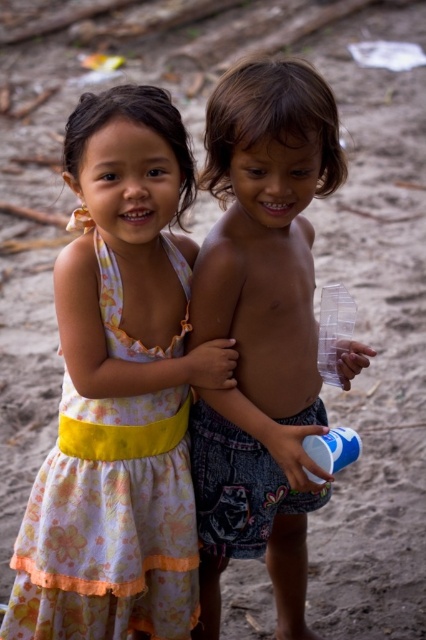
Does floral cotton dress at center have a lesser width compared to shiny plastic cup at center?

In fact, floral cotton dress at center might be wider than shiny plastic cup at center.

Which is behind, point (14, 637) or point (206, 113)?

Point (206, 113)

The image size is (426, 640). Find the location of `floral cotton dress at center`. floral cotton dress at center is located at coordinates (120, 392).

Is shiny plastic cup at center thinner than floral cotton dress at left?

Correct, shiny plastic cup at center's width is less than floral cotton dress at left's.

Does shiny plastic cup at center lie in front of floral cotton dress at left?

Yes, it is.

The width and height of the screenshot is (426, 640). What do you see at coordinates (261, 330) in the screenshot?
I see `shiny plastic cup at center` at bounding box center [261, 330].

Where is `shiny plastic cup at center`? shiny plastic cup at center is located at coordinates pos(261,330).

Does floral cotton dress at center have a greater width compared to floral cotton dress at left?

Correct, the width of floral cotton dress at center exceeds that of floral cotton dress at left.

Is floral cotton dress at center closer to camera compared to floral cotton dress at left?

Yes, it is in front of floral cotton dress at left.

Identify the location of floral cotton dress at center. The image size is (426, 640). 120,392.